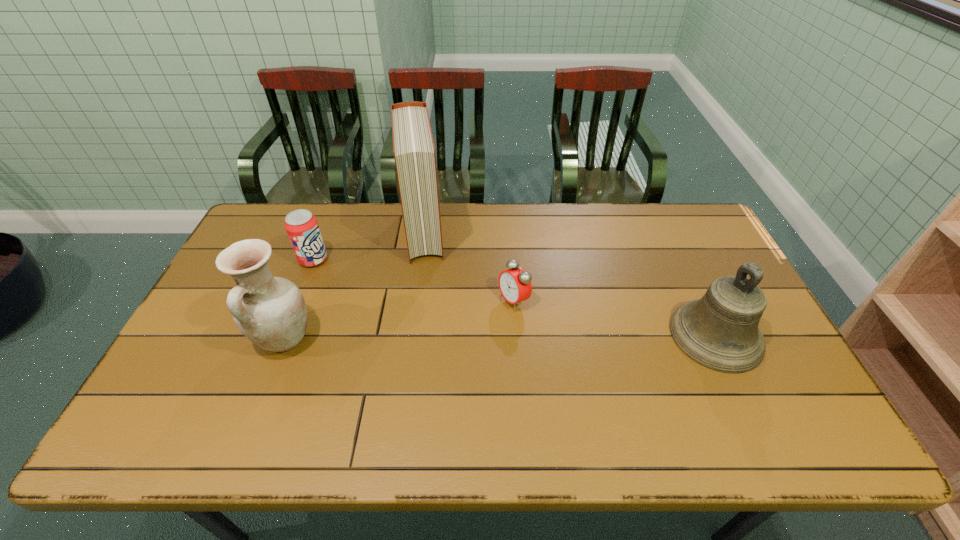
Identify the location of pottery. The height and width of the screenshot is (540, 960). (271, 312).

Locate an element on the screen. bell is located at coordinates pyautogui.click(x=720, y=331).

The width and height of the screenshot is (960, 540). In order to click on soda can in this screenshot , I will do `click(302, 228)`.

In order to click on the second object from right to left in this screenshot , I will do `click(515, 286)`.

Where is `the shortest object`? the shortest object is located at coordinates (515, 286).

At what (x,y) coordinates should I click in order to perform the action: click on hardback book. Please return your answer as a coordinate pair (x, y). Looking at the image, I should click on (413, 146).

Image resolution: width=960 pixels, height=540 pixels. Find the location of `the tallest object`. the tallest object is located at coordinates (413, 146).

Locate an element on the screen. The width and height of the screenshot is (960, 540). vacant space located 0.120m on the left of the pottery is located at coordinates (208, 340).

You are a GUI agent. You are given a task and a screenshot of the screen. Output one action in this format:
    pyautogui.click(x=<x>, y=<y>)
    Task: Click on the free spot located on the left of the rightmost object
    Image resolution: width=960 pixels, height=540 pixels.
    Given the screenshot: What is the action you would take?
    pyautogui.click(x=642, y=335)

Locate an element on the screen. vacant area situated 0.300m on the surface of the soda can is located at coordinates (390, 308).